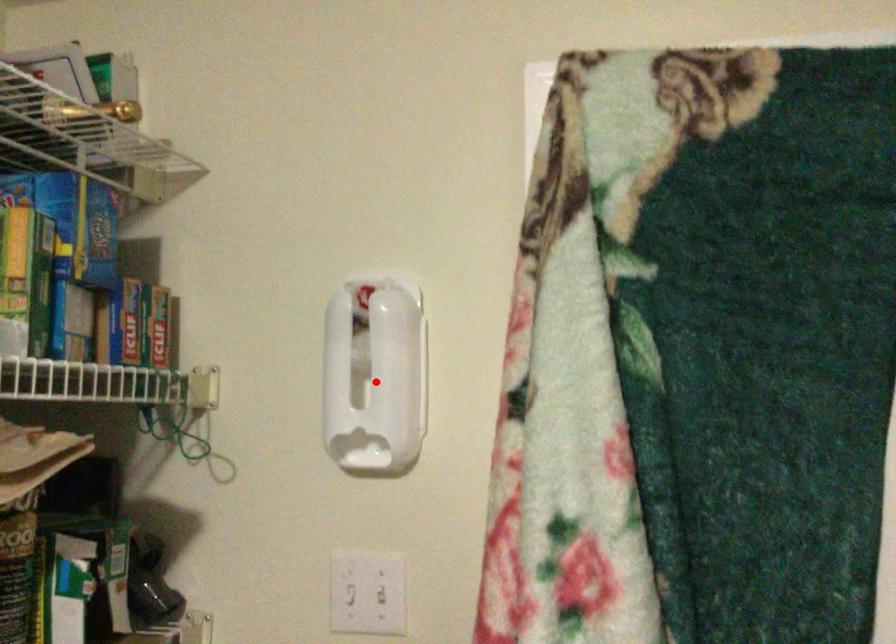
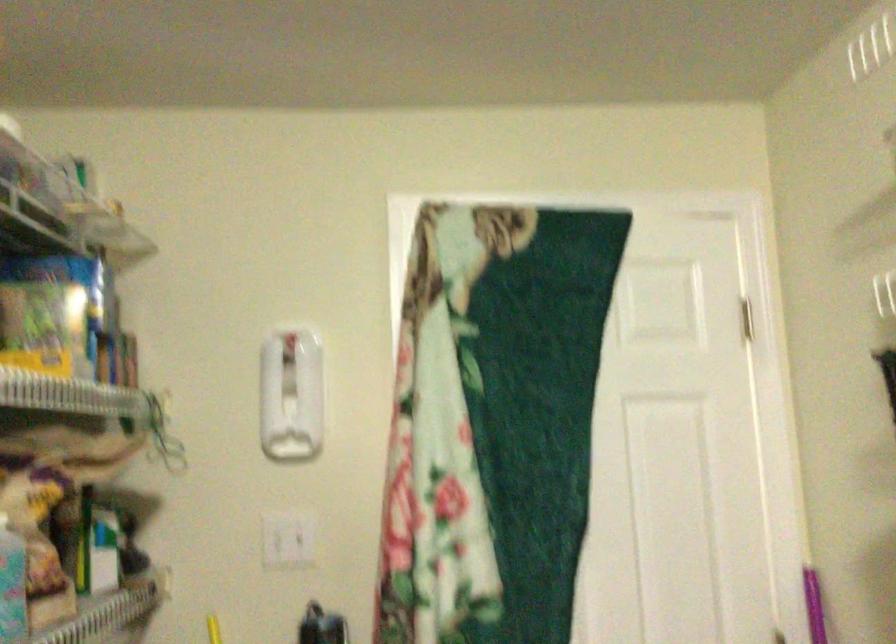
Find the pixel in the second image that matches the highlighted location in the first image.

(290, 395)